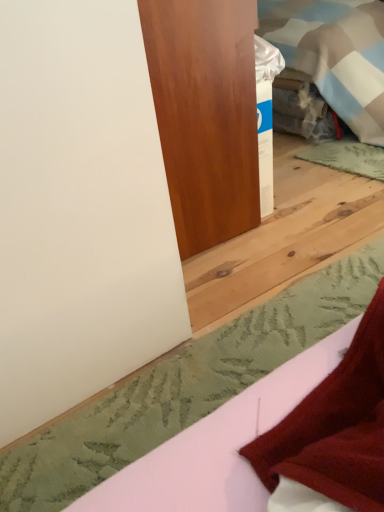
Question: Is there a large distance between satin wood door at upper center and white matte sheet at lower right?

Choices:
 (A) no
 (B) yes

Answer: (A)

Question: Is white matte sheet at lower right at the back of satin wood door at upper center?

Choices:
 (A) no
 (B) yes

Answer: (A)

Question: Is satin wood door at upper center further to the viewer compared to white matte sheet at lower right?

Choices:
 (A) yes
 (B) no

Answer: (A)

Question: Does satin wood door at upper center have a smaller size compared to white matte sheet at lower right?

Choices:
 (A) no
 (B) yes

Answer: (A)

Question: Is satin wood door at upper center bigger than white matte sheet at lower right?

Choices:
 (A) no
 (B) yes

Answer: (B)

Question: Is satin wood door at upper center facing towards white matte sheet at lower right?

Choices:
 (A) no
 (B) yes

Answer: (A)

Question: Can you confirm if white matte sheet at lower right is thinner than satin wood door at upper center?

Choices:
 (A) yes
 (B) no

Answer: (B)

Question: From the image's perspective, is white matte sheet at lower right on satin wood door at upper center?

Choices:
 (A) yes
 (B) no

Answer: (B)

Question: Does white matte sheet at lower right have a greater height compared to satin wood door at upper center?

Choices:
 (A) no
 (B) yes

Answer: (A)

Question: Does white matte sheet at lower right contain satin wood door at upper center?

Choices:
 (A) no
 (B) yes

Answer: (A)

Question: Is white matte sheet at lower right at the left side of satin wood door at upper center?

Choices:
 (A) yes
 (B) no

Answer: (B)

Question: Is white matte sheet at lower right far from satin wood door at upper center?

Choices:
 (A) no
 (B) yes

Answer: (A)

Question: In terms of width, does white matte sheet at lower right look wider or thinner when compared to satin wood door at upper center?

Choices:
 (A) wide
 (B) thin

Answer: (A)